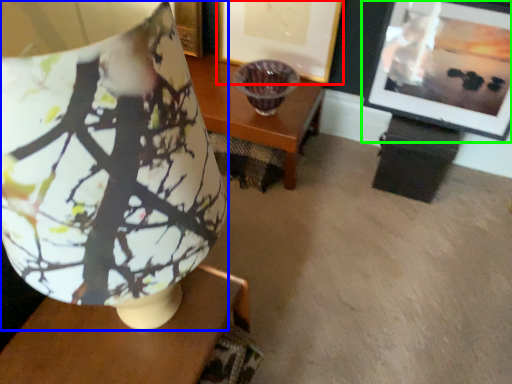
Question: Based on their relative distances, which object is farther from picture frame (highlighted by a red box)? Choose from lamp (highlighted by a blue box) and picture frame (highlighted by a green box).

Choices:
 (A) lamp
 (B) picture frame

Answer: (A)